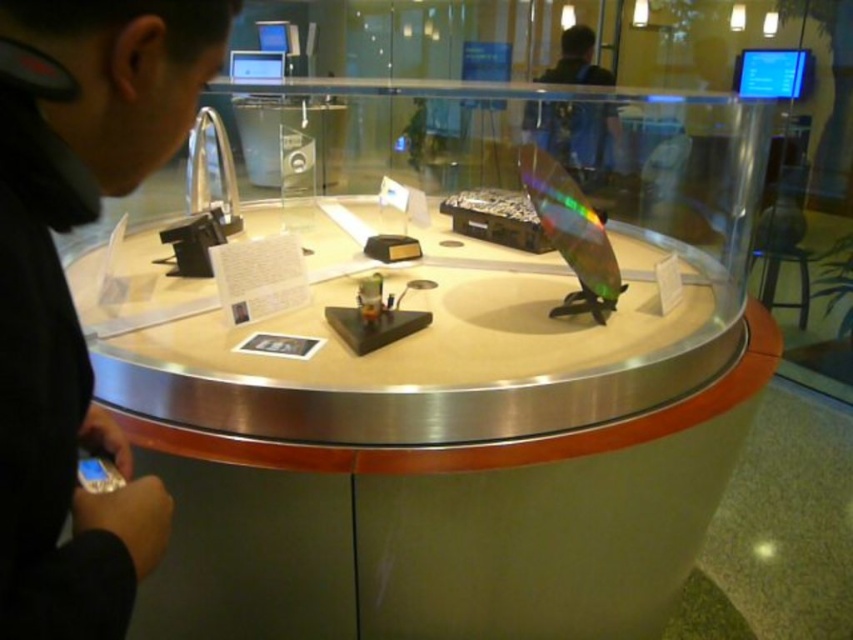
You are a museum visitor who wants to place a small souvenir on the table. The souvenir is exactly the same size as the black matte phone at left. Will the matte silver table at center be wide enough to accommodate it?

The matte silver table at center is wider than the black matte phone at left, so yes, the table can accommodate the souvenir since its width is sufficient.

You are standing in front of a museum display case and want to touch the point at coordinates (347, 474) inside the case. If your hand can reach up to 1.2 meters, will you be able to reach that point?

The point at coordinates (347, 474) is 1.19 meters away from you, so yes, your hand can reach it since it is within the 1.2 meter limit.